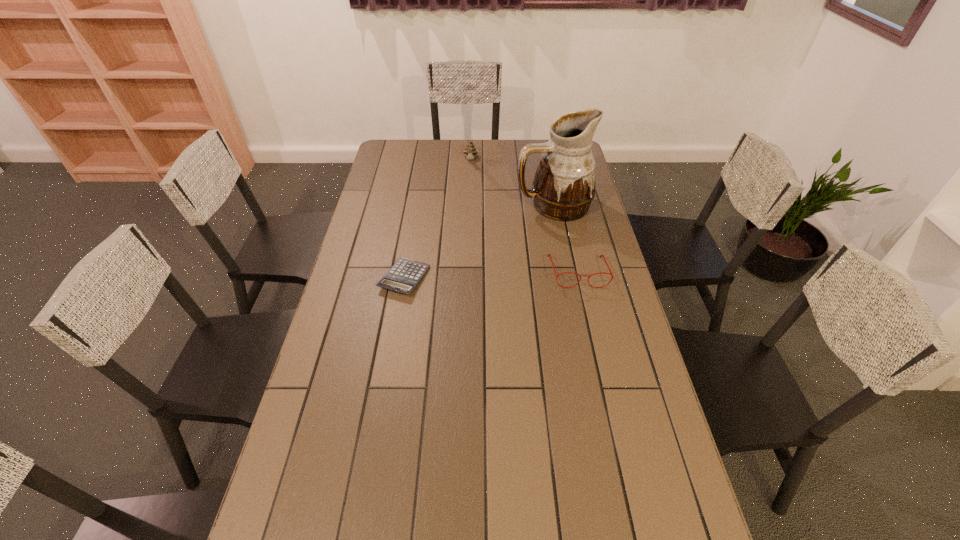
Find the location of a particular element. The height and width of the screenshot is (540, 960). the leftmost object is located at coordinates (403, 277).

Find the location of a particular element. the shortest object is located at coordinates (403, 277).

Image resolution: width=960 pixels, height=540 pixels. Identify the location of spectacles. click(600, 256).

Locate an element on the screen. This screenshot has height=540, width=960. the tallest object is located at coordinates (563, 188).

This screenshot has width=960, height=540. I want to click on the third nearest object, so (x=563, y=188).

At what (x,y) coordinates should I click in order to perform the action: click on snail. Please return your answer as a coordinate pair (x, y). The width and height of the screenshot is (960, 540). Looking at the image, I should click on (470, 150).

Identify the location of the second tallest object. (470, 150).

Locate an element on the screen. The image size is (960, 540). vacant space located 0.060m on the left of the calculator is located at coordinates (362, 278).

Where is `free location located 0.350m on the face of the third tallest object`? The width and height of the screenshot is (960, 540). free location located 0.350m on the face of the third tallest object is located at coordinates 603,382.

This screenshot has width=960, height=540. What are the coordinates of `vacant space located from the spout of the pitcher` in the screenshot? It's located at (516, 233).